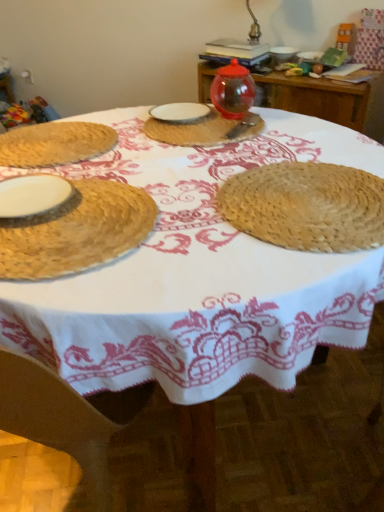
Locate an element on the screen. The image size is (384, 512). free space above woven straw placemat at left, which ranks as the 1th table in left-to-right order (from a real-world perspective) is located at coordinates [51, 139].